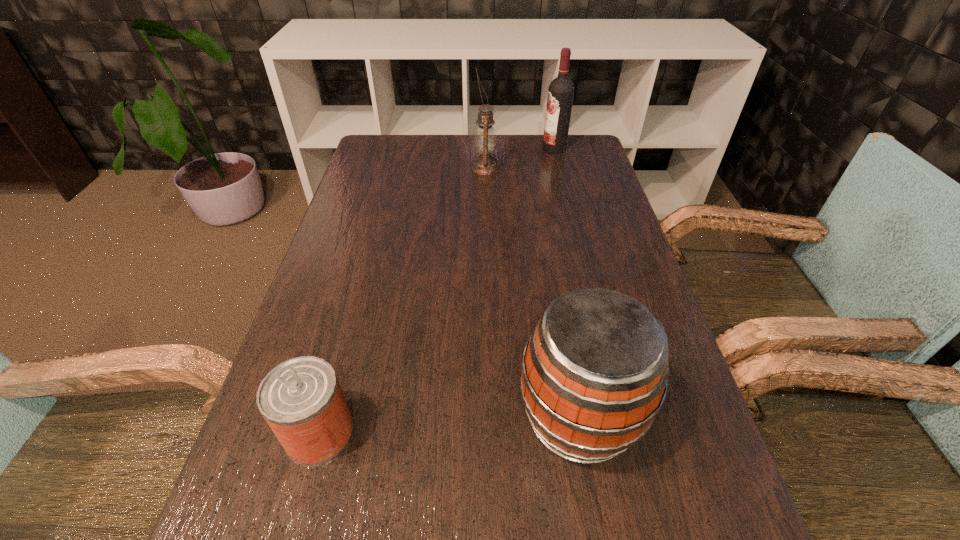
This screenshot has width=960, height=540. Find the location of `vacant space situated on the back of the second shortest object`. vacant space situated on the back of the second shortest object is located at coordinates click(x=562, y=318).

The width and height of the screenshot is (960, 540). What are the coordinates of `vacant space situated 0.110m on the back of the can` in the screenshot? It's located at click(342, 353).

Where is `wine bottle that is at the far edge`? wine bottle that is at the far edge is located at coordinates (561, 90).

At what (x,y) coordinates should I click in order to perform the action: click on oil lamp that is at the far edge. Please return your answer as a coordinate pair (x, y). Looking at the image, I should click on (485, 142).

Locate an element on the screen. object located in the left edge section of the desktop is located at coordinates (301, 399).

You are a GUI agent. You are given a task and a screenshot of the screen. Output one action in this format:
    pyautogui.click(x=<x>, y=<y>)
    Task: Click on the wine bottle located in the right edge section of the desktop
    
    Given the screenshot: What is the action you would take?
    pyautogui.click(x=561, y=90)

Locate an element on the screen. cider that is at the right edge is located at coordinates (594, 374).

Image resolution: width=960 pixels, height=540 pixels. I want to click on object that is positioned at the far right corner, so [x=561, y=90].

What are the coordinates of `free region at the far edge` in the screenshot? It's located at (540, 150).

Locate an element on the screen. This screenshot has height=540, width=960. blank space at the left edge of the desktop is located at coordinates (348, 251).